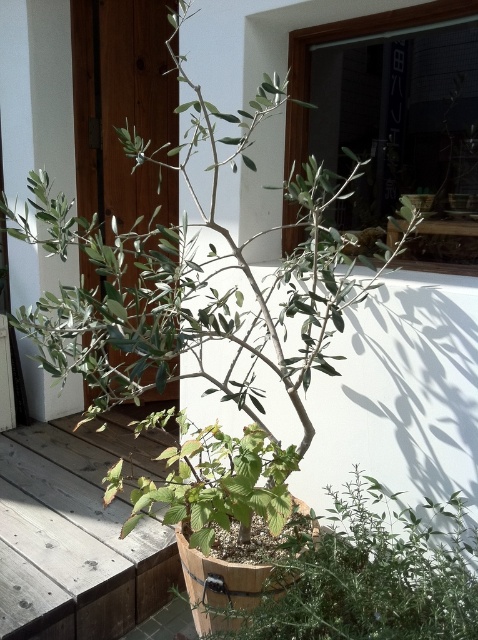
Can you confirm if green leafy plant at center is bigger than green matte plant at center?

Incorrect, green leafy plant at center is not larger than green matte plant at center.

Who is lower down, green leafy plant at center or green matte plant at center?

green leafy plant at center is below.

Does point (434, 598) lie in front of point (196, 464)?

Yes, point (434, 598) is closer to viewer.

Where is `green leafy plant at center`? Image resolution: width=478 pixels, height=640 pixels. green leafy plant at center is located at coordinates (371, 573).

Who is higher up, gray wood deck at lower left or green matte plant at center?

green matte plant at center is higher up.

Does gray wood deck at lower left appear on the left side of green matte plant at center?

Yes, gray wood deck at lower left is to the left of green matte plant at center.

This screenshot has height=640, width=478. I want to click on gray wood deck at lower left, so click(85, 524).

Can you confirm if green leafy plant at center is positioned to the left of gray wood deck at lower left?

Incorrect, green leafy plant at center is not on the left side of gray wood deck at lower left.

Who is more forward, (303, 557) or (148, 440)?

Point (303, 557)

Is point (443, 624) farther from camera compared to point (82, 556)?

No, it is in front of (82, 556).

Identify the location of green leafy plant at center. (371, 573).